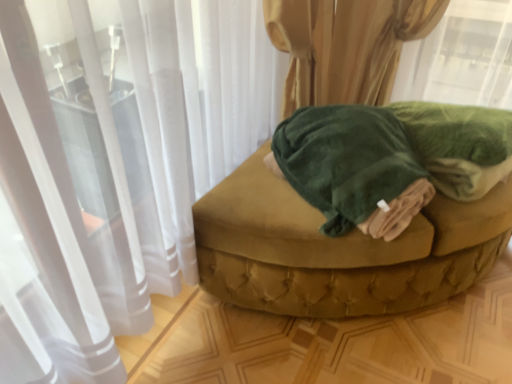
Locate an element on the screen. velvet green ottoman at center is located at coordinates (354, 213).

The width and height of the screenshot is (512, 384). What do you see at coordinates (354, 213) in the screenshot?
I see `velvet green ottoman at center` at bounding box center [354, 213].

What do you see at coordinates (352, 167) in the screenshot? Image resolution: width=512 pixels, height=384 pixels. I see `green plush bath towel at center` at bounding box center [352, 167].

Find the location of `green plush bath towel at center`. green plush bath towel at center is located at coordinates (352, 167).

Image resolution: width=512 pixels, height=384 pixels. I want to click on velvet green ottoman at center, so click(x=354, y=213).

Can you confirm if green plush bath towel at center is positioned to the left of velvet green ottoman at center?

Yes, green plush bath towel at center is to the left of velvet green ottoman at center.

Looking at this image, which is in front, green plush bath towel at center or velvet green ottoman at center?

green plush bath towel at center.

Considering the points (387, 160) and (313, 266), which point is in front, point (387, 160) or point (313, 266)?

The point (387, 160) is closer.

From the image's perspective, between green plush bath towel at center and velvet green ottoman at center, which one is located above?

green plush bath towel at center is shown above in the image.

From a real-world perspective, which object stands above the other?

In real-world perspective, green plush bath towel at center is above.

Is green plush bath towel at center thinner than velvet green ottoman at center?

Indeed, green plush bath towel at center has a lesser width compared to velvet green ottoman at center.

Between green plush bath towel at center and velvet green ottoman at center, which one has more height?

With more height is velvet green ottoman at center.

Considering the sizes of objects green plush bath towel at center and velvet green ottoman at center in the image provided, who is smaller, green plush bath towel at center or velvet green ottoman at center?

green plush bath towel at center is smaller.

Is green plush bath towel at center not inside velvet green ottoman at center?

Absolutely, green plush bath towel at center is external to velvet green ottoman at center.

Is green plush bath towel at center with velvet green ottoman at center?

No, green plush bath towel at center is not next to velvet green ottoman at center.

Is green plush bath towel at center facing away from velvet green ottoman at center?

No, velvet green ottoman at center is not at the back of green plush bath towel at center.

How distant is green plush bath towel at center from velvet green ottoman at center?

green plush bath towel at center is 4.19 inches from velvet green ottoman at center.

Find the location of a particular element. The image size is (512, 384). furniture below the green plush bath towel at center (from the image's perspective) is located at coordinates click(x=354, y=213).

Can you confirm if velvet green ottoman at center is positioned to the right of green plush bath towel at center?

Indeed, velvet green ottoman at center is positioned on the right side of green plush bath towel at center.

In the image, is velvet green ottoman at center positioned in front of or behind green plush bath towel at center?

Visually, velvet green ottoman at center is located behind green plush bath towel at center.

Between point (239, 191) and point (356, 216), which one is positioned behind?

Positioned behind is point (239, 191).

From the image's perspective, is velvet green ottoman at center on top of green plush bath towel at center?

No, from the image's perspective, velvet green ottoman at center is not on top of green plush bath towel at center.

From a real-world perspective, who is located lower, velvet green ottoman at center or green plush bath towel at center?

velvet green ottoman at center.

Considering the sizes of objects velvet green ottoman at center and green plush bath towel at center in the image provided, who is wider, velvet green ottoman at center or green plush bath towel at center?

velvet green ottoman at center is wider.

Consider the image. Is velvet green ottoman at center shorter than green plush bath towel at center?

In fact, velvet green ottoman at center may be taller than green plush bath towel at center.

Between velvet green ottoman at center and green plush bath towel at center, which one has smaller size?

green plush bath towel at center.

Is velvet green ottoman at center inside or outside of green plush bath towel at center?

velvet green ottoman at center is not enclosed by green plush bath towel at center.

Is velvet green ottoman at center positioned far away from green plush bath towel at center?

No.

Is velvet green ottoman at center facing towards green plush bath towel at center?

No, velvet green ottoman at center is not oriented towards green plush bath towel at center.

How different are the orientations of velvet green ottoman at center and green plush bath towel at center in degrees?

The angle between the facing direction of velvet green ottoman at center and the facing direction of green plush bath towel at center is 12.4 degrees.

At what (x,y) coordinates should I click in order to perform the action: click on furniture below the green plush bath towel at center (from a real-world perspective). Please return your answer as a coordinate pair (x, y). Looking at the image, I should click on (354, 213).

The image size is (512, 384). I want to click on bath towel above the velvet green ottoman at center (from a real-world perspective), so tap(352, 167).

Identify the location of furniture beneath the green plush bath towel at center (from a real-world perspective). (354, 213).